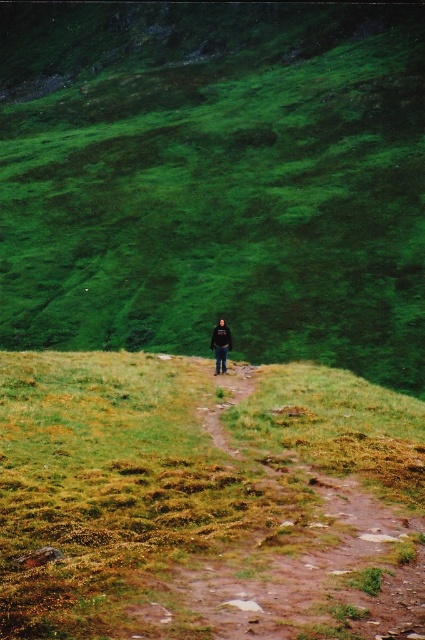
You are a hiker trying to navigate the grassy hill. You notice the green mossy ground at center and the black fabric person at center. Which object is higher up on the hill?

The green mossy ground at center is taller than the black fabric person at center, so the green mossy ground at center is higher up on the hill.

You are a hiker standing at the bottom of the hill. You see the green grassy hillside at center and the black fabric person at center. Which object is higher in elevation?

The green grassy hillside at center is located above the black fabric person at center, so it is higher in elevation.

You are standing at the bottom of the hill and want to reach the black fabric person at center. The green grassy hillside at center is between you and the person. Is the hillside closer to you or to the person?

The green grassy hillside at center is 400.89 feet away from the black fabric person at center. Since you are at the bottom of the hill, the hillside is closer to you than to the person.